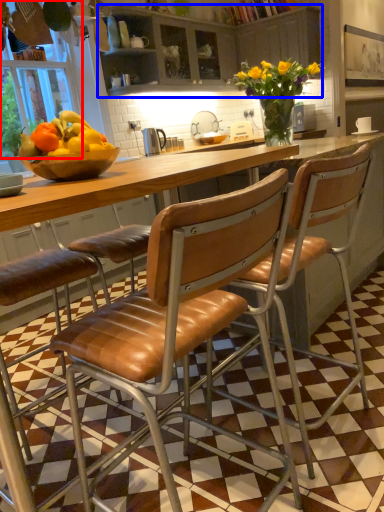
Question: Among these objects, which one is farthest to the camera, window screen (highlighted by a red box) or cabinetry (highlighted by a blue box)?

Choices:
 (A) window screen
 (B) cabinetry

Answer: (B)